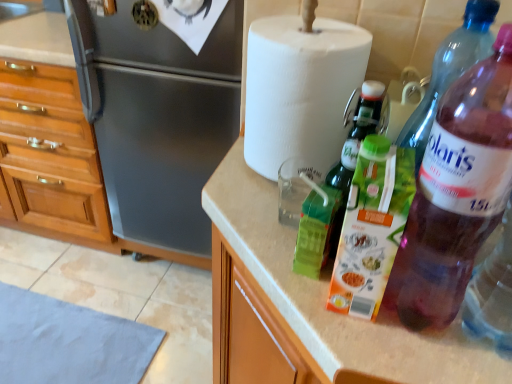
You are a GUI agent. You are given a task and a screenshot of the screen. Output one action in this format:
    pyautogui.click(x=<x>, y=<y>)
    Task: Click on the vacant area that is in front of white paper towel at upper center
    
    Given the screenshot: What is the action you would take?
    pyautogui.click(x=259, y=220)